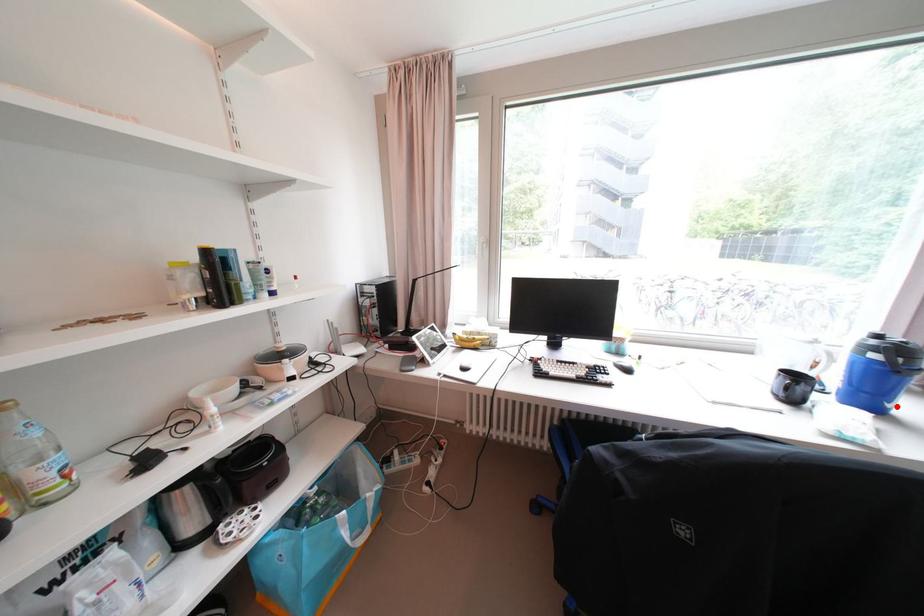
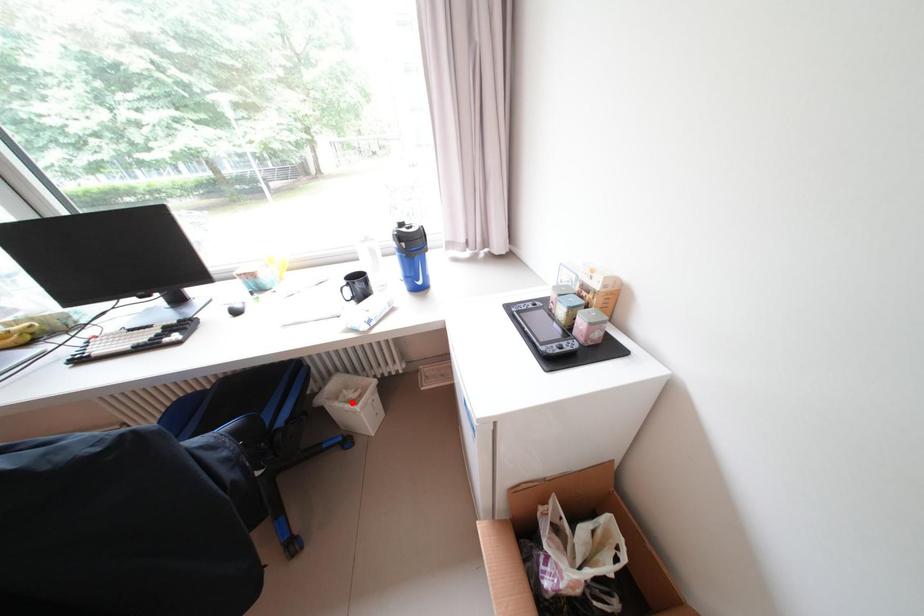
I am providing you with two images of the same scene from different viewpoints. A red point is marked on the first image and another point is marked on the second image. Are the points marked in image1 and image2 representing the same 3D position?

No